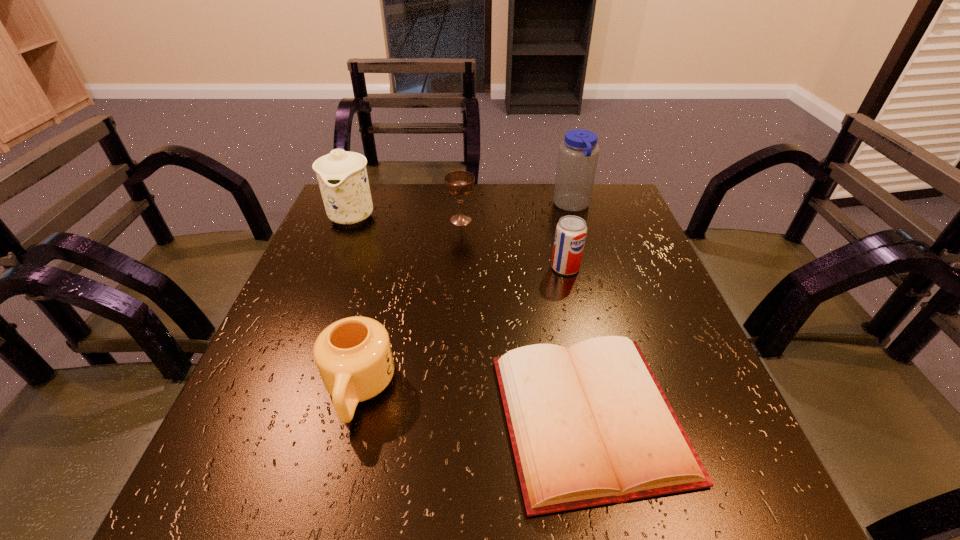
Locate an element on the screen. free space located on the right of the third object from left to right is located at coordinates (523, 220).

Locate an element on the screen. The width and height of the screenshot is (960, 540). vacant space situated on the front of the third nearest object is located at coordinates (571, 295).

Where is `free space located 0.050m on the handle side of the fifth object from right to left`? This screenshot has height=540, width=960. free space located 0.050m on the handle side of the fifth object from right to left is located at coordinates (341, 463).

You are a GUI agent. You are given a task and a screenshot of the screen. Output one action in this format:
    pyautogui.click(x=<x>, y=<y>)
    Task: Click on the free point located 0.120m on the back of the shortest object
    The image size is (960, 540).
    Given the screenshot: What is the action you would take?
    pyautogui.click(x=565, y=302)

Locate an element on the screen. This screenshot has height=540, width=960. water bottle situated at the far edge is located at coordinates (578, 154).

Locate an element on the screen. This screenshot has height=540, width=960. chinaware positioned at the far edge is located at coordinates (342, 176).

Locate an element on the screen. The image size is (960, 540). chalice that is at the far edge is located at coordinates (459, 183).

Where is `object that is at the near edge`? object that is at the near edge is located at coordinates (591, 425).

At what (x,y) coordinates should I click in order to perform the action: click on chinaware located at the left edge. Please return your answer as a coordinate pair (x, y). The image size is (960, 540). Looking at the image, I should click on (342, 176).

Where is `mug that is at the left edge`? mug that is at the left edge is located at coordinates (353, 355).